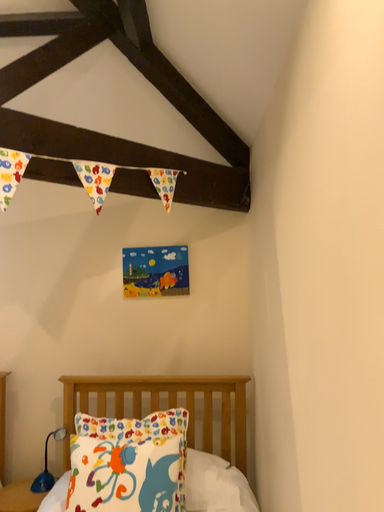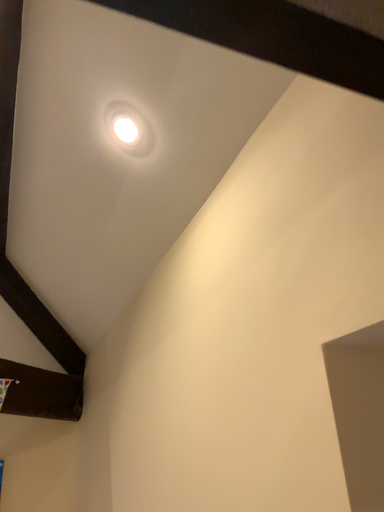
Question: Which way did the camera rotate in the video?

Choices:
 (A) rotated upward
 (B) rotated downward

Answer: (A)